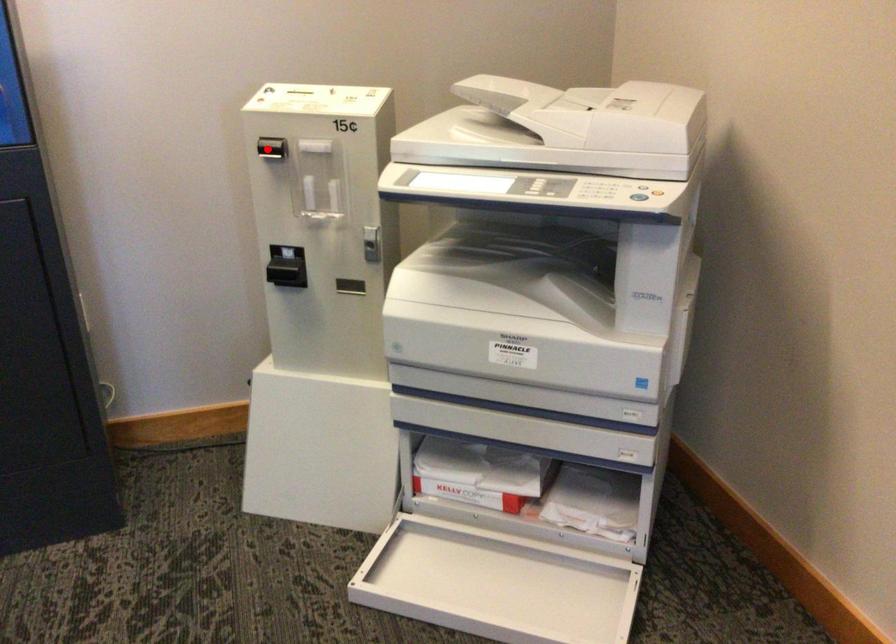
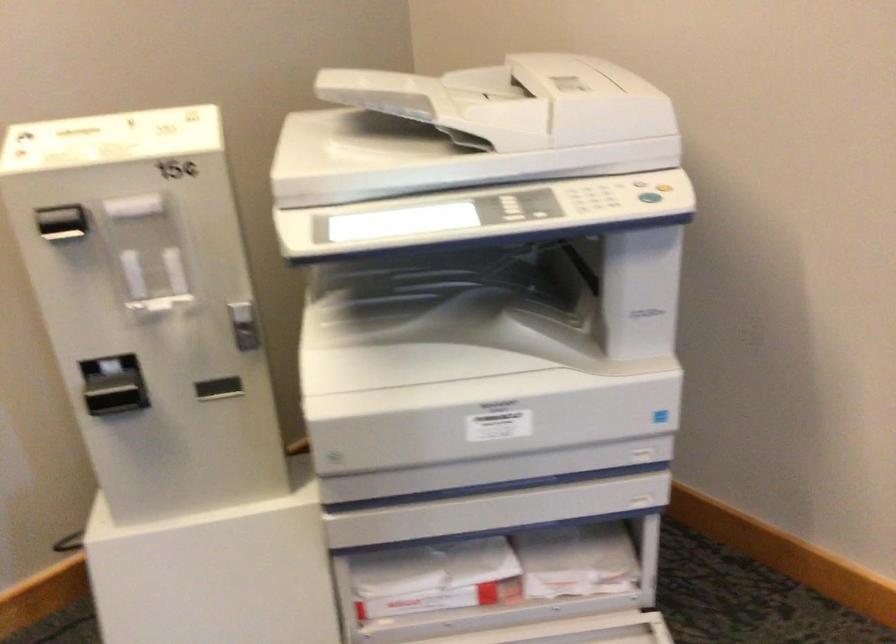
Question: I am providing you with two images of the same scene from different viewpoints. In image1, a red point is highlighted. Considering the same 3D point in image2, which of the following is correct?

Choices:
 (A) It is closer
 (B) It is farther

Answer: (A)